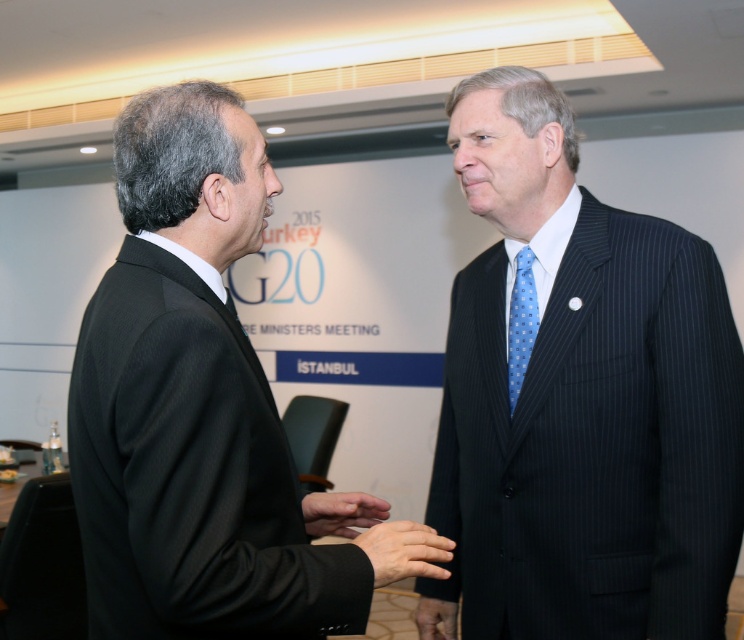
Can you confirm if black pinstripe suit at left is positioned to the left of smooth skin hand at center?

Indeed, black pinstripe suit at left is positioned on the left side of smooth skin hand at center.

Between point (147, 282) and point (448, 547), which one is positioned behind?

The point (448, 547) is behind.

Who is more distant from viewer, (254, 605) or (382, 522)?

Point (382, 522)

The image size is (744, 640). Identify the location of black pinstripe suit at left. (190, 403).

Who is positioned more to the left, smooth skin hand at center or matte black hand at center?

matte black hand at center is more to the left.

Which is behind, point (359, 534) or point (378, 513)?

The point (378, 513) is more distant.

Where is `smooth skin hand at center`? smooth skin hand at center is located at coordinates (400, 548).

Who is positioned more to the right, dark blue pinstripe suit at right or black pinstripe suit at left?

dark blue pinstripe suit at right is more to the right.

The image size is (744, 640). What are the coordinates of `dark blue pinstripe suit at right` in the screenshot? It's located at (583, 397).